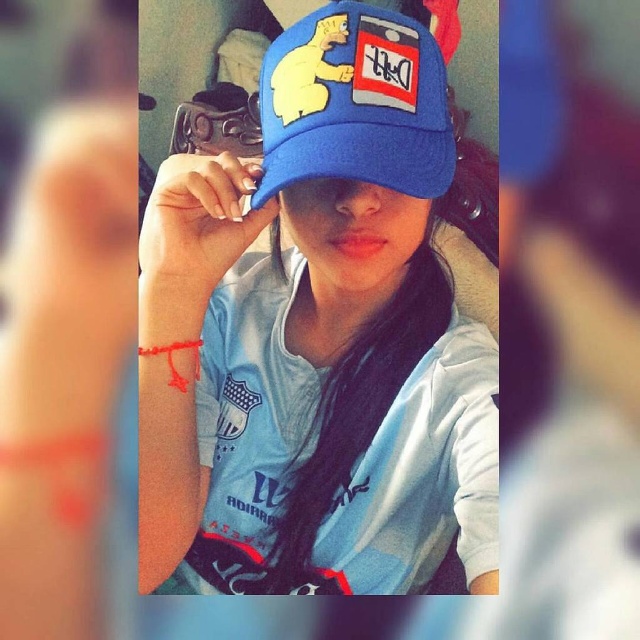
Question: Which object is closer to the camera taking this photo?

Choices:
 (A) blue fabric cap at center
 (B) blue fabric baseball cap at center

Answer: (A)

Question: Which of the following is the farthest from the observer?

Choices:
 (A) (340, 188)
 (B) (397, 93)

Answer: (A)

Question: Where is blue fabric cap at center located in relation to blue fabric baseball cap at center in the image?

Choices:
 (A) above
 (B) below

Answer: (B)

Question: Is blue fabric cap at center below blue fabric baseball cap at center?

Choices:
 (A) no
 (B) yes

Answer: (B)

Question: Which point appears closest to the camera in this image?

Choices:
 (A) (429, 344)
 (B) (285, 172)

Answer: (B)

Question: Does blue fabric cap at center appear on the left side of blue fabric baseball cap at center?

Choices:
 (A) yes
 (B) no

Answer: (A)